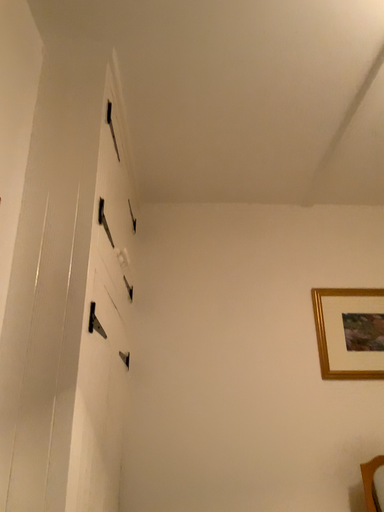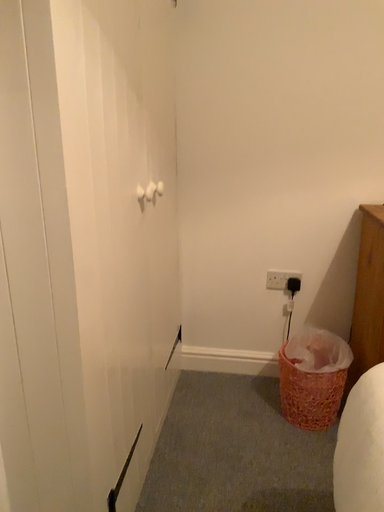
Question: How did the camera likely rotate when shooting the video?

Choices:
 (A) rotated upward
 (B) rotated downward

Answer: (B)